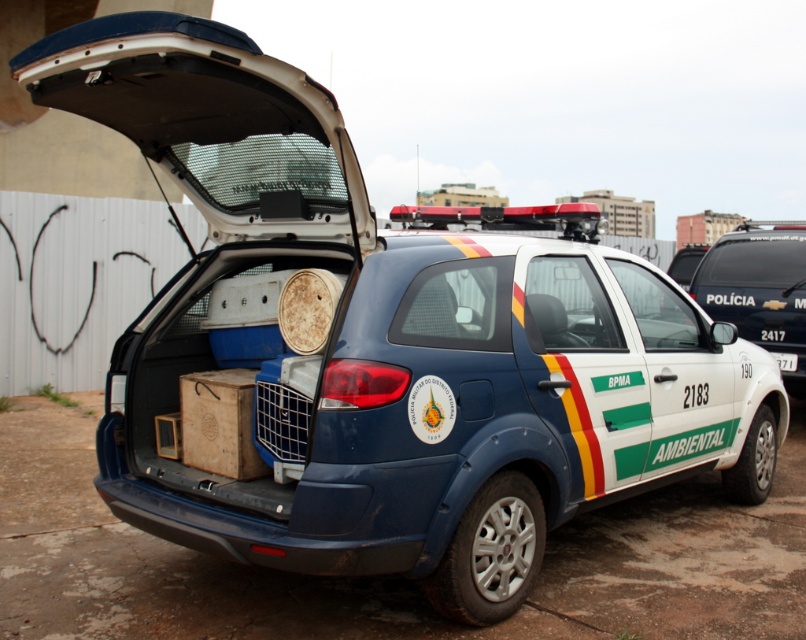
Question: Does white glossy minivan at center have a lesser width compared to white plastic license plate at center?

Choices:
 (A) yes
 (B) no

Answer: (B)

Question: Which of the following is the closest to the observer?

Choices:
 (A) (791, 356)
 (B) (188, 413)
 (C) (705, 266)

Answer: (B)

Question: Which point is farther to the camera?

Choices:
 (A) brown cardboard box at rear
 (B) white plastic license plate at center

Answer: (B)

Question: Can you confirm if brown cardboard box at rear is smaller than white plastic license plate at center?

Choices:
 (A) yes
 (B) no

Answer: (B)

Question: Which point is closer to the camera taking this photo?

Choices:
 (A) (188, 426)
 (B) (796, 356)
 (C) (700, 280)

Answer: (A)

Question: Does white glossy minivan at center have a lesser width compared to white plastic license plate at center?

Choices:
 (A) no
 (B) yes

Answer: (A)